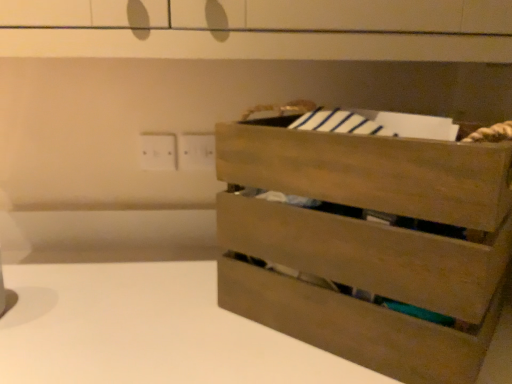
Question: Is point (173, 137) closer or farther from the camera than point (406, 291)?

Choices:
 (A) closer
 (B) farther

Answer: (B)

Question: Would you say white plastic electric outlet at upper left is to the left or to the right of natural wood crate at right in the picture?

Choices:
 (A) right
 (B) left

Answer: (B)

Question: Is white plastic electric outlet at upper left taller or shorter than natural wood crate at right?

Choices:
 (A) tall
 (B) short

Answer: (B)

Question: Considering their positions, is natural wood crate at right located in front of or behind white plastic electric outlet at upper left?

Choices:
 (A) front
 (B) behind

Answer: (A)

Question: From their relative heights in the image, would you say natural wood crate at right is taller or shorter than white plastic electric outlet at upper left?

Choices:
 (A) tall
 (B) short

Answer: (A)

Question: Is natural wood crate at right inside or outside of white plastic electric outlet at upper left?

Choices:
 (A) outside
 (B) inside

Answer: (A)

Question: Does point (365, 327) appear closer or farther from the camera than point (176, 167)?

Choices:
 (A) farther
 (B) closer

Answer: (B)